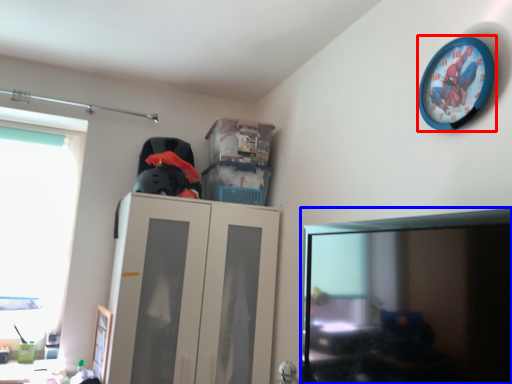
Question: Which object is further to the camera taking this photo, wall clock (highlighted by a red box) or computer monitor (highlighted by a blue box)?

Choices:
 (A) wall clock
 (B) computer monitor

Answer: (A)